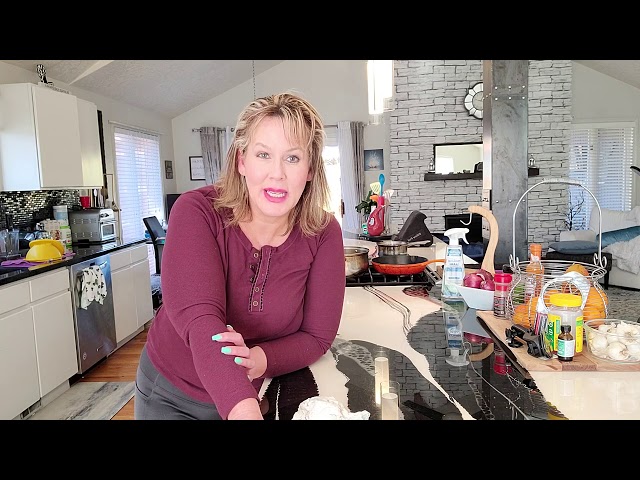
Where is `towels`? The height and width of the screenshot is (480, 640). towels is located at coordinates (95, 279).